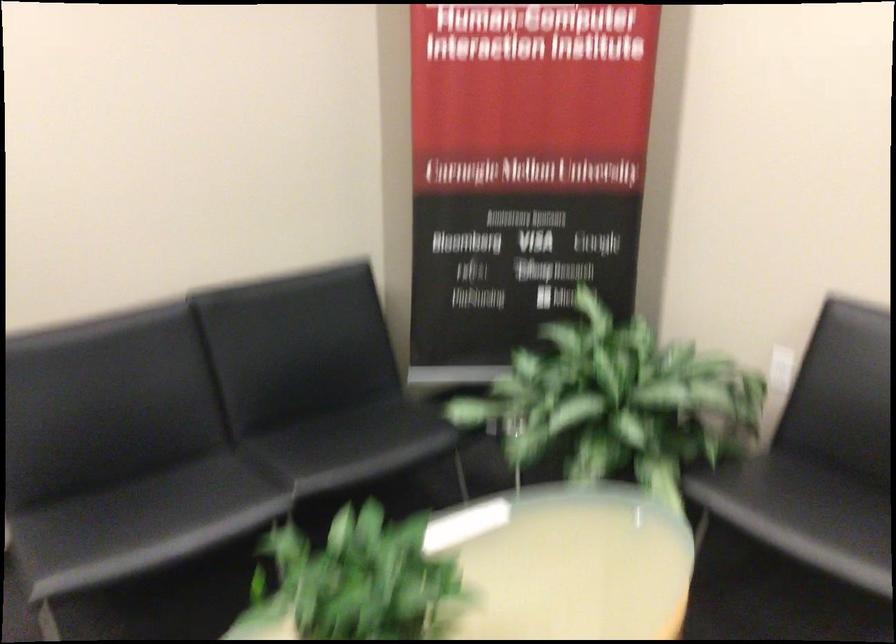
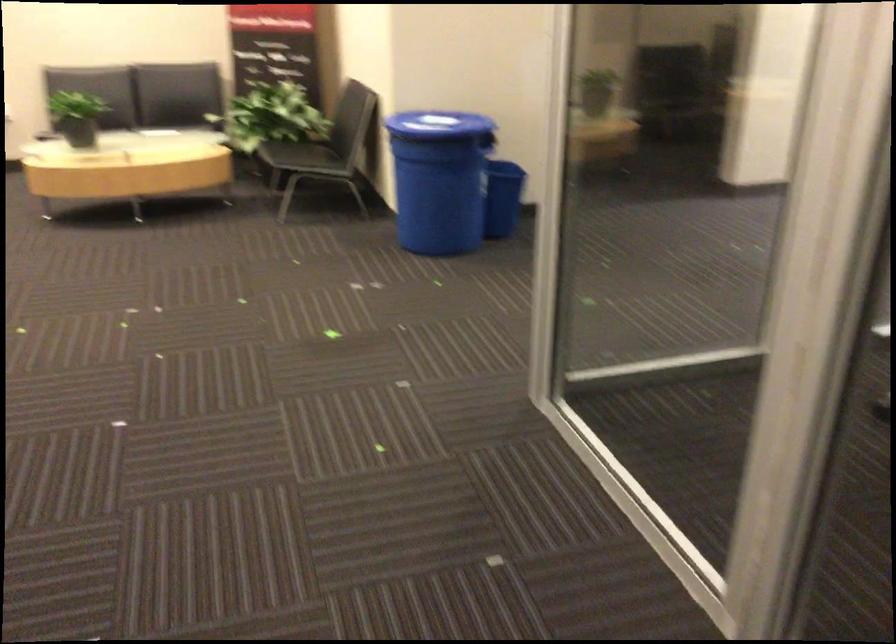
Find the pixel in the second image that matches point 289,576 in the first image.

(76, 116)